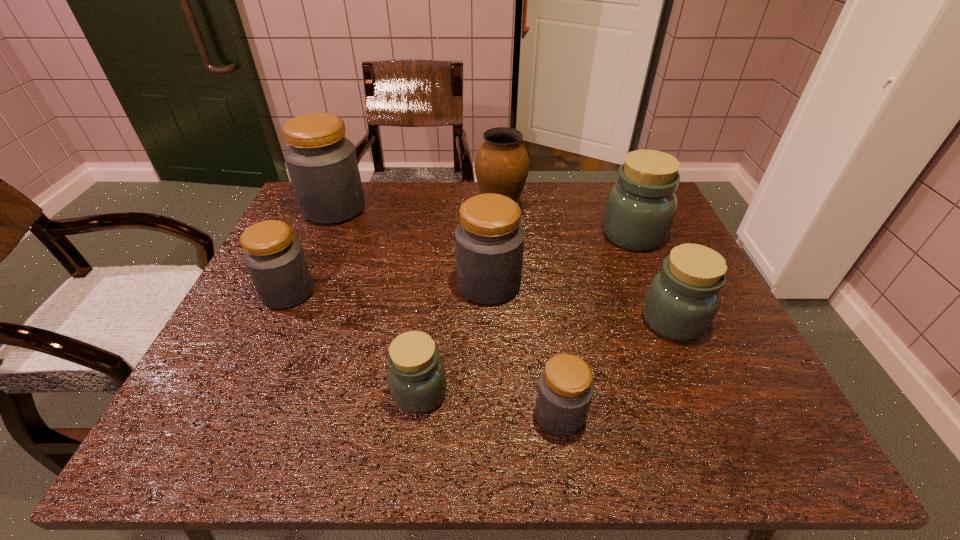
This screenshot has height=540, width=960. I want to click on blank space located on the left of the leftmost green jar, so click(346, 393).

Where is `free space located 0.400m on the surface of the rightmost gray jar near the warning symbol`? The image size is (960, 540). free space located 0.400m on the surface of the rightmost gray jar near the warning symbol is located at coordinates (320, 414).

Locate an element on the screen. The height and width of the screenshot is (540, 960). free space located 0.130m on the surface of the rightmost gray jar near the warning symbol is located at coordinates (465, 414).

Identify the location of vacant point located on the surface of the rightmost gray jar near the warning symbol. This screenshot has width=960, height=540. (411, 414).

Where is `urn present at the far edge`? The image size is (960, 540). urn present at the far edge is located at coordinates click(x=501, y=165).

Locate an element on the screen. The image size is (960, 540). object situated at the far left corner is located at coordinates (322, 164).

At what (x,y) coordinates should I click in order to perform the action: click on object at the far right corner. Please return your answer as a coordinate pair (x, y). The image size is (960, 540). Looking at the image, I should click on (640, 209).

Find the location of `free space at the far edge`. free space at the far edge is located at coordinates (466, 192).

Where is `free space at the near edge of the desktop`? The image size is (960, 540). free space at the near edge of the desktop is located at coordinates (338, 447).

In the image, there is a desktop. Where is `free space at the left edge`? free space at the left edge is located at coordinates (281, 318).